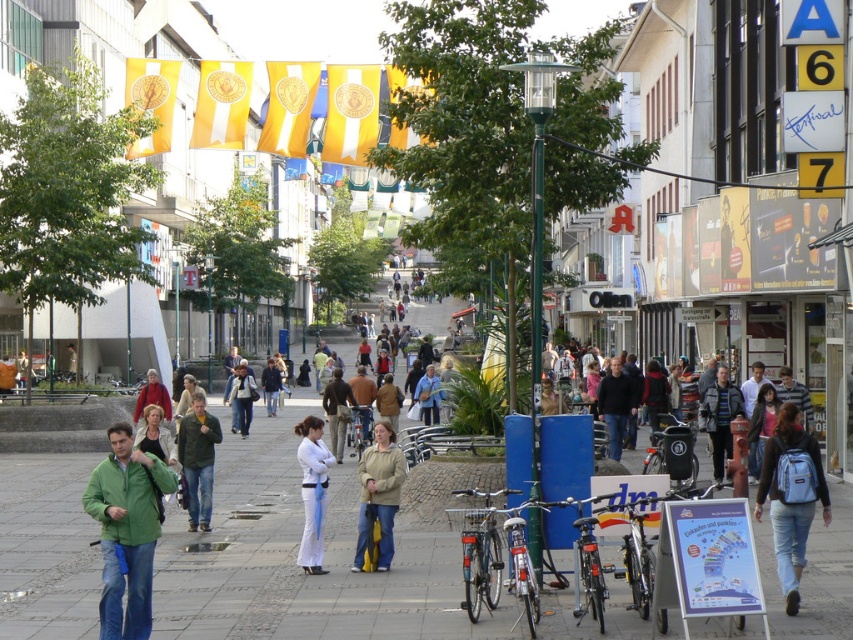
Question: Where is light brown leather jacket at center located in relation to brown leather jacket at center in the image?

Choices:
 (A) below
 (B) above

Answer: (B)

Question: Where is smooth concrete pavement at center located in relation to dark blue jacket at center in the image?

Choices:
 (A) left
 (B) right

Answer: (B)

Question: Based on their relative distances, which object is nearer to the smooth concrete pavement at center?

Choices:
 (A) blue backpack at lower right
 (B) white matte pants at center

Answer: (B)

Question: Among these objects, which one is nearest to the camera?

Choices:
 (A) blue backpack at lower right
 (B) light brown leather jacket at center

Answer: (A)

Question: Which is farther from the blue backpack at lower right?

Choices:
 (A) green matte jacket at lower left
 (B) dark blue jeans at center
 (C) brown leather jacket at center

Answer: (C)

Question: Is light brown leather jacket at center to the left of white matte pants at center from the viewer's perspective?

Choices:
 (A) no
 (B) yes

Answer: (A)